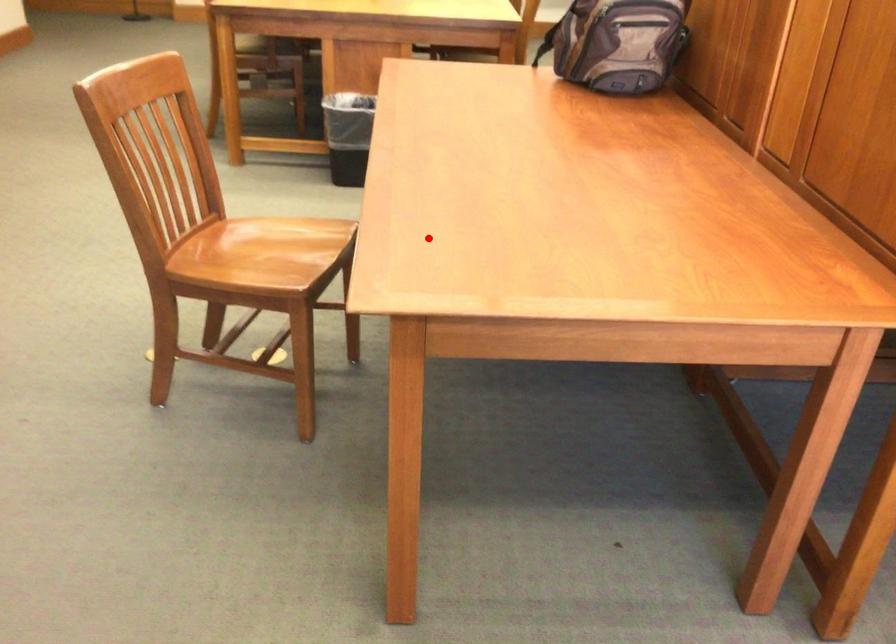
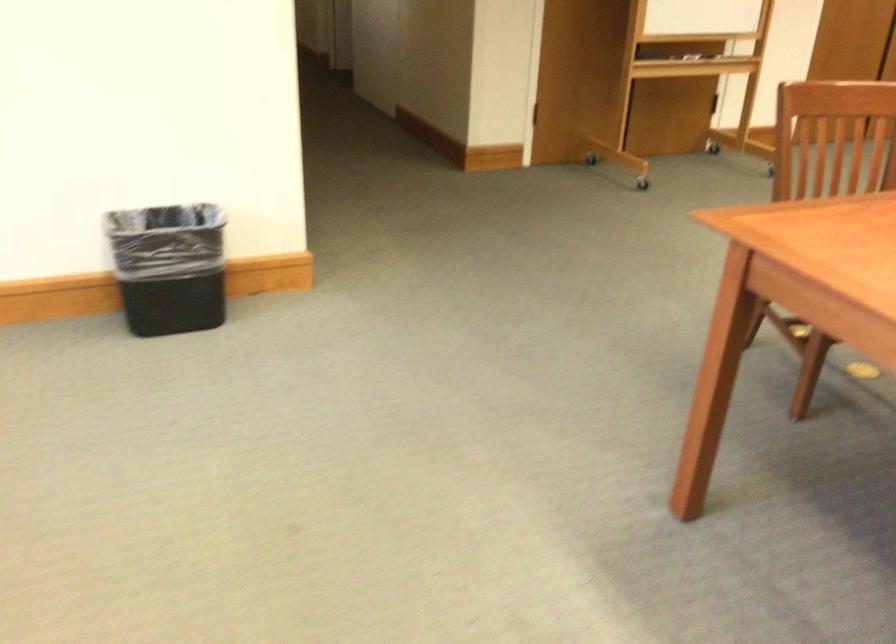
Question: I am providing you with two images of the same scene from different viewpoints. Image1 has a red point marked. In image2, the corresponding 3D location appears at what relative position? Reply with the corresponding letter.

Choices:
 (A) Closer
 (B) Farther

Answer: (B)